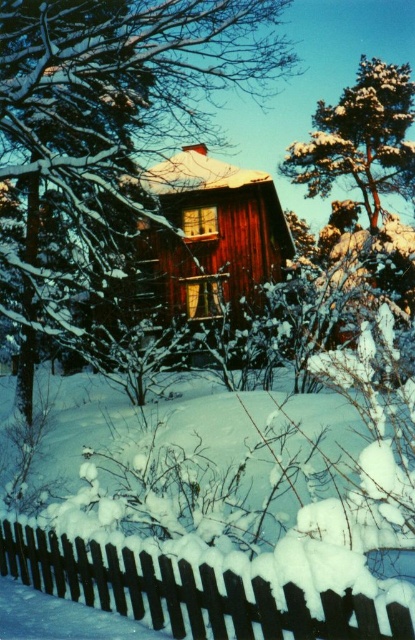
Between smooth wooden house at center and smooth wooden cabin at center, which one has more height?

Standing taller between the two is smooth wooden house at center.

Does smooth wooden house at center have a lesser height compared to smooth wooden cabin at center?

No.

Locate an element on the screen. The width and height of the screenshot is (415, 640). smooth wooden house at center is located at coordinates tap(109, 122).

In the scene shown: Is smooth wooden house at center behind snow-covered wooden fence at lower center?

Yes, it is.

Is smooth wooden house at center shorter than snow-covered wooden fence at lower center?

No.

You are a GUI agent. You are given a task and a screenshot of the screen. Output one action in this format:
    pyautogui.click(x=<x>, y=<y>)
    Task: Click on the smooth wooden house at center
    The image size is (415, 640).
    Given the screenshot: What is the action you would take?
    pyautogui.click(x=109, y=122)

Who is shorter, snow-covered wooden fence at lower center or snow-covered pine tree at upper right?

With less height is snow-covered wooden fence at lower center.

Is snow-covered wooden fence at lower center smaller than snow-covered pine tree at upper right?

Correct, snow-covered wooden fence at lower center occupies less space than snow-covered pine tree at upper right.

Locate an element on the screen. This screenshot has height=640, width=415. snow-covered wooden fence at lower center is located at coordinates (190, 592).

Image resolution: width=415 pixels, height=640 pixels. What are the coordinates of `snow-covered wooden fence at lower center` in the screenshot? It's located at (190, 592).